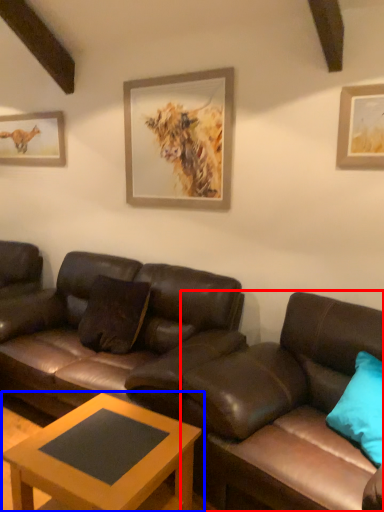
Question: Which of the following is the closest to the observer, studio couch (highlighted by a red box) or coffee table (highlighted by a blue box)?

Choices:
 (A) studio couch
 (B) coffee table

Answer: (A)